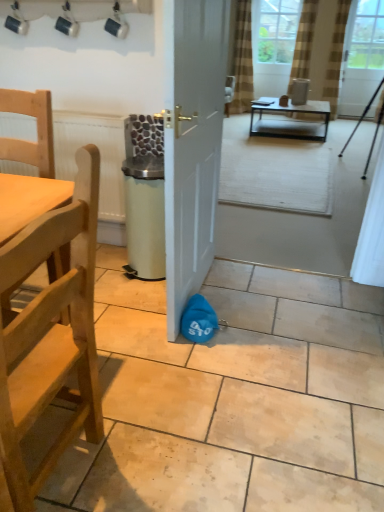
The height and width of the screenshot is (512, 384). I want to click on vacant area that lies in front of white glossy door at center, so click(184, 365).